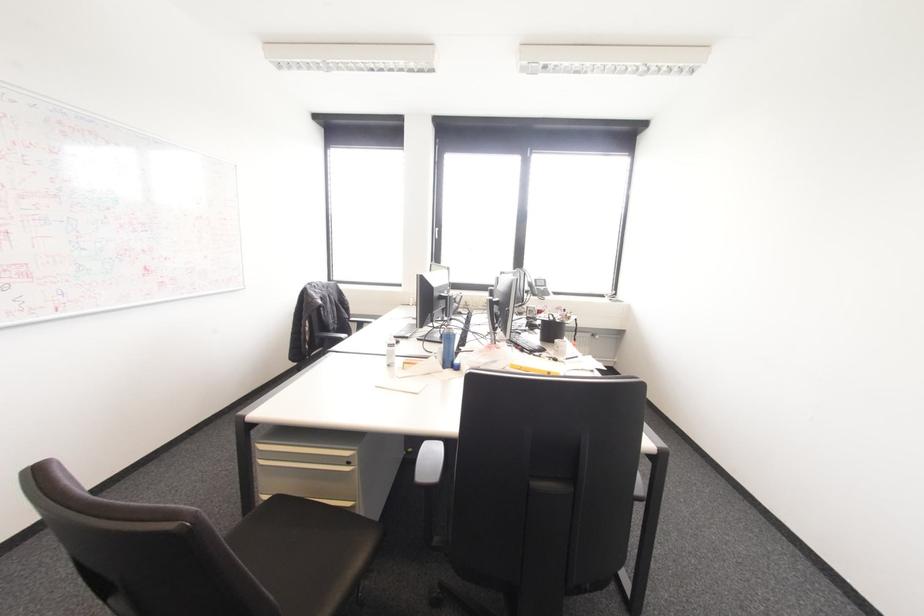
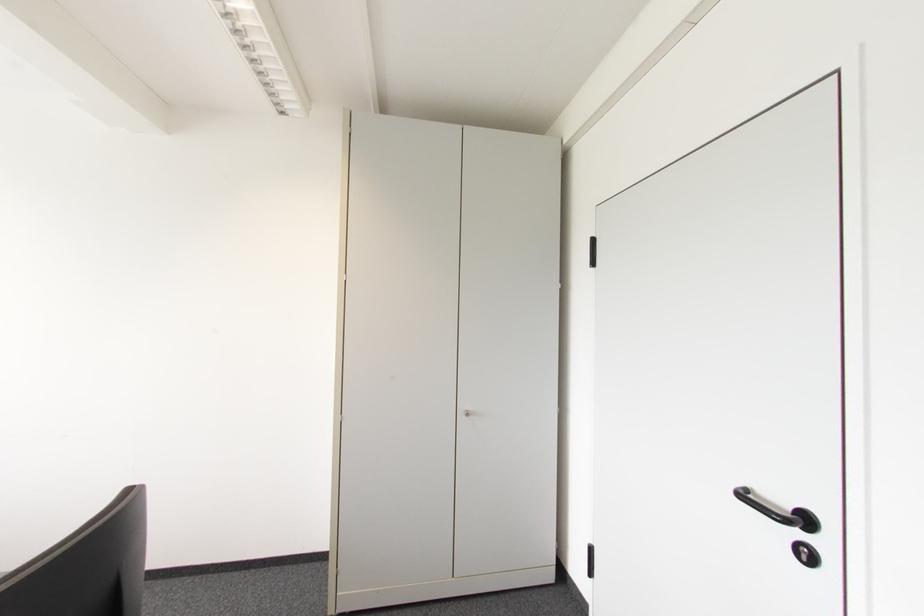
Question: The camera is either moving clockwise (left) or counter-clockwise (right) around the object. The first image is from the beginning of the video and the second image is from the end. Is the camera moving left or right when shooting the video?

Choices:
 (A) Left
 (B) Right

Answer: (A)